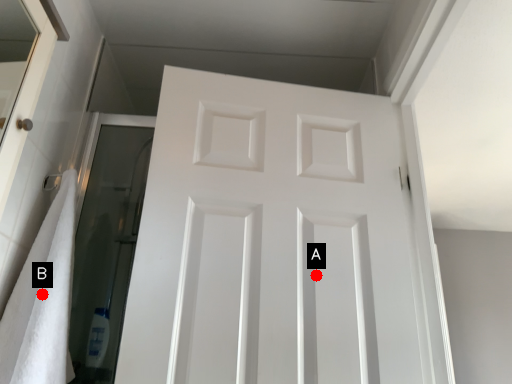
Question: Two points are circled on the image, labeled by A and B beside each circle. Which of the following is the closest to the observer?

Choices:
 (A) A is closer
 (B) B is closer

Answer: (B)